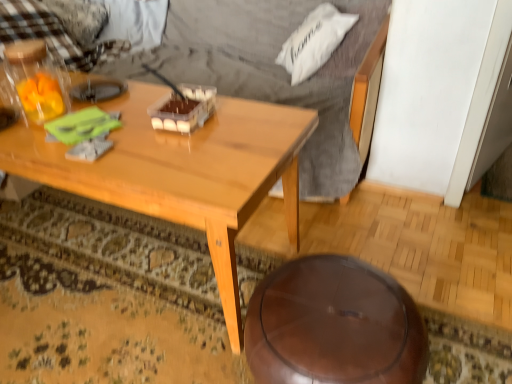
What are the coordinates of `vacant area that is situated to the right of translucent plastic container at center` in the screenshot? It's located at (248, 117).